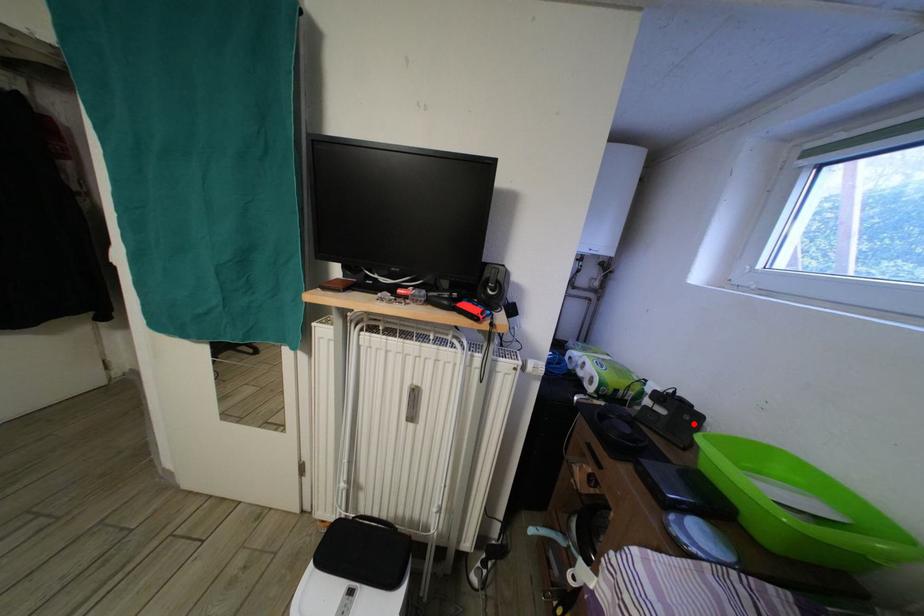
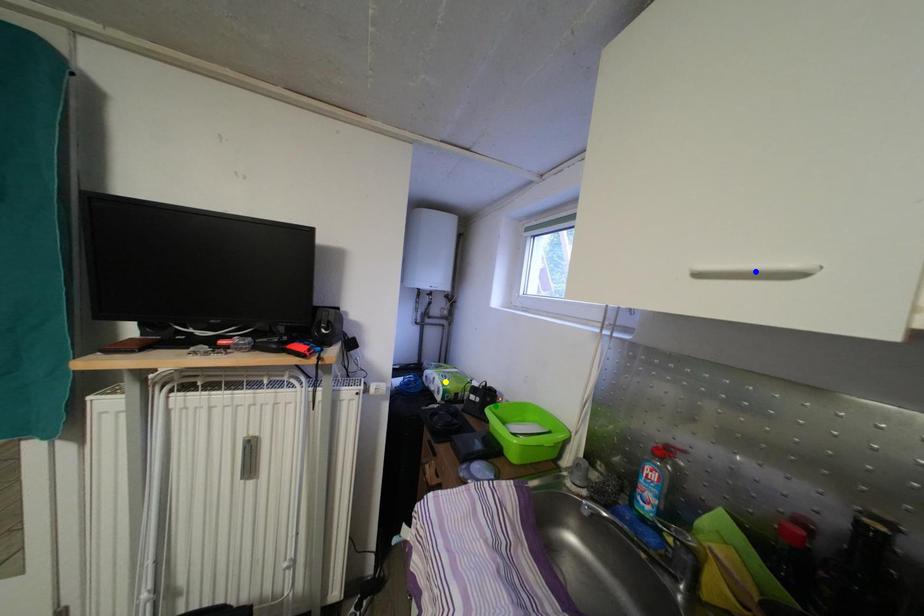
Question: I am providing you with two images of the same scene from different viewpoints. A red point is marked on the first image. You are given multiple points on the second image. Can you choose the point in image 2 that corresponds to the point in image 1?

Choices:
 (A) blue point
 (B) green point
 (C) yellow point

Answer: (B)